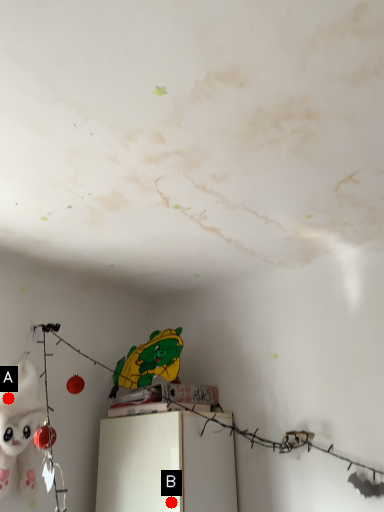
Question: Two points are circled on the image, labeled by A and B beside each circle. Which point is closer to the camera taking this photo?

Choices:
 (A) A is closer
 (B) B is closer

Answer: (B)